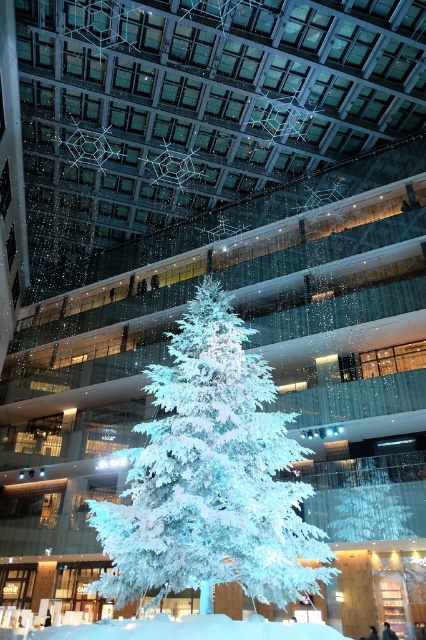
Who is lower down, white frosty tree at center or white frosty snow at center?

white frosty snow at center is lower down.

Is white frosty tree at center taller than white frosty snow at center?

Indeed, white frosty tree at center has a greater height compared to white frosty snow at center.

Who is more distant from viewer, (311, 572) or (186, 616)?

The point (311, 572) is behind.

The height and width of the screenshot is (640, 426). Identify the location of white frosty tree at center. (210, 476).